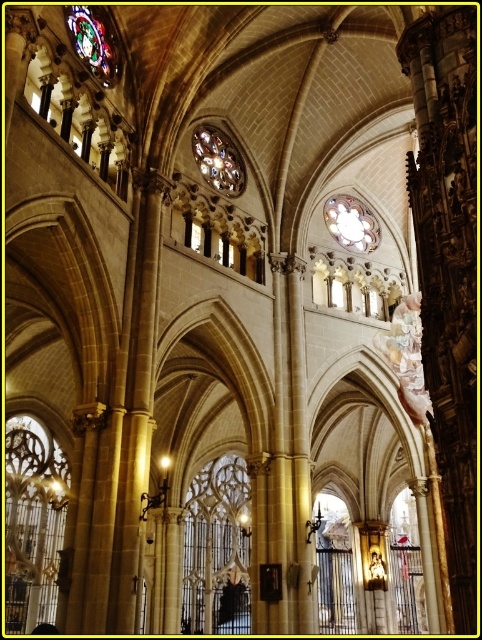
Looking at this image, is multicolored stained glass at upper center thinner than matte glass clock at center?

Yes, multicolored stained glass at upper center is thinner than matte glass clock at center.

Is point (208, 163) farther from camera compared to point (348, 202)?

No, it is not.

Identify the location of multicolored stained glass at upper center. This screenshot has width=482, height=640. (218, 161).

Does clear glass window at lower left appear on the left side of matte glass clock at center?

Yes, clear glass window at lower left is to the left of matte glass clock at center.

Between point (32, 502) and point (335, 234), which one is positioned behind?

The point (32, 502) is behind.

Between point (21, 576) and point (373, 218), which one is positioned behind?

Point (373, 218)

Where is `clear glass window at lower left`? The image size is (482, 640). clear glass window at lower left is located at coordinates (35, 513).

Between clear glass window at center and matte glass clock at center, which one is positioned higher?

matte glass clock at center is above.

Measure the distance between point (231,552) and camera.

Point (231,552) and camera are 117.00 meters apart from each other.

Where is `clear glass window at center`? clear glass window at center is located at coordinates (216, 548).

I want to click on clear glass window at center, so click(216, 548).